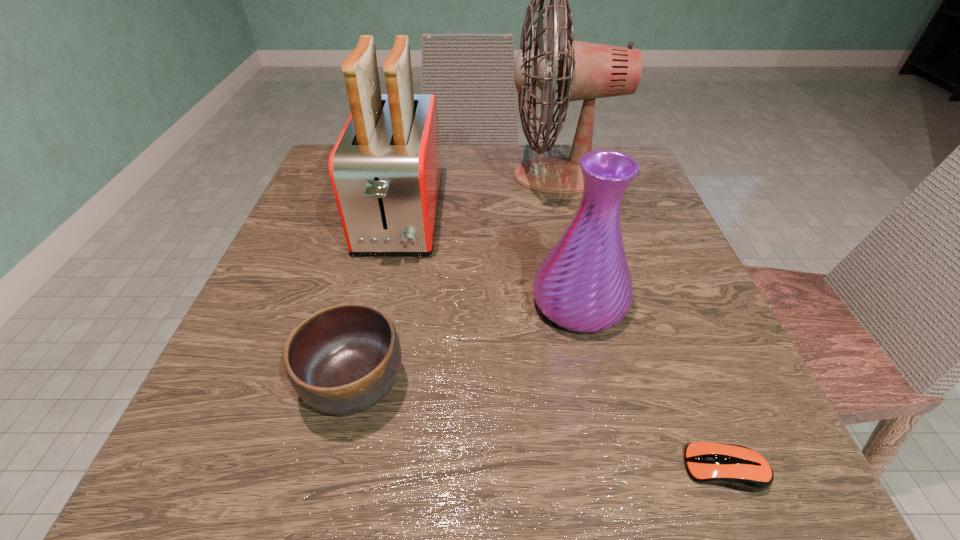
At what (x,y) coordinates should I click in order to perform the action: click on fan. Please return your answer as a coordinate pair (x, y). The image size is (960, 540). Looking at the image, I should click on point(585,71).

Where is `the fourth shortest object`? This screenshot has width=960, height=540. the fourth shortest object is located at coordinates (385, 169).

Find the location of a particular element. The height and width of the screenshot is (540, 960). the third shortest object is located at coordinates (584, 284).

You are a GUI agent. You are given a task and a screenshot of the screen. Output one action in this format:
    pyautogui.click(x=<x>, y=<y>)
    Task: Click on the third nearest object
    
    Given the screenshot: What is the action you would take?
    pyautogui.click(x=584, y=284)

What are the coordinates of `the fourth farthest object` in the screenshot? It's located at (343, 359).

Locate an element on the screen. The height and width of the screenshot is (540, 960). the second shortest object is located at coordinates (343, 359).

The width and height of the screenshot is (960, 540). Identify the location of the shortest object. (737, 467).

This screenshot has height=540, width=960. I want to click on the nearest object, so 737,467.

You are a GUI agent. You are given a task and a screenshot of the screen. Output one action in this format:
    pyautogui.click(x=<x>, y=<y>)
    Task: Click on the free space located 0.170m in front of the fan to direct airflow
    This screenshot has height=540, width=960.
    Given the screenshot: What is the action you would take?
    pyautogui.click(x=433, y=176)

Find the location of a particular element. vacant space located 0.330m in front of the fan to direct airflow is located at coordinates (362, 176).